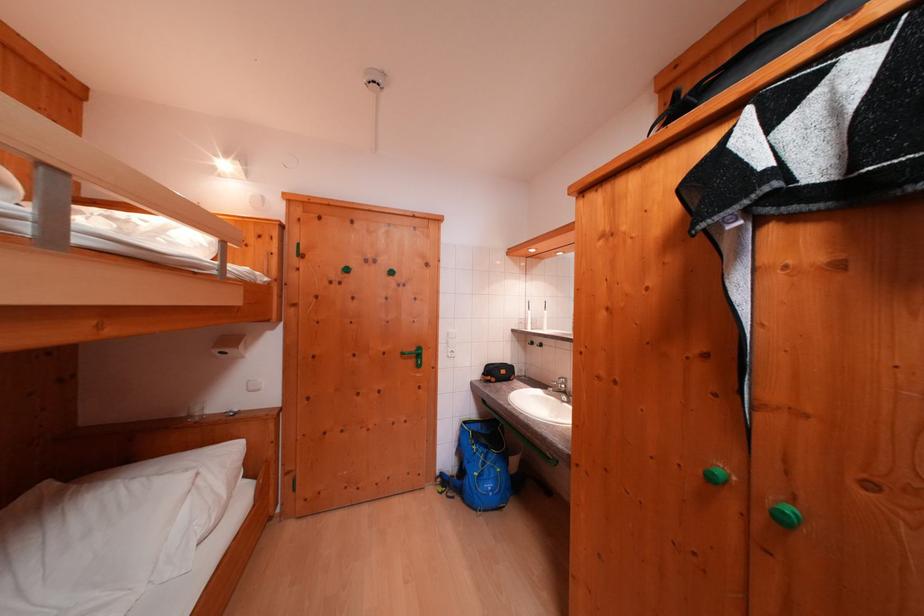
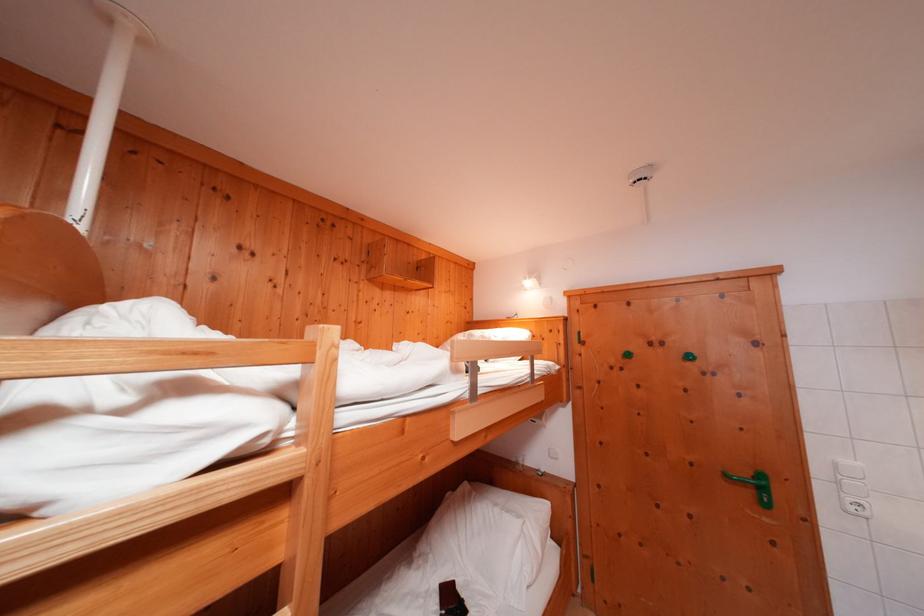
In the second image, find the point that corresponds to [457,359] in the first image.

(858, 513)